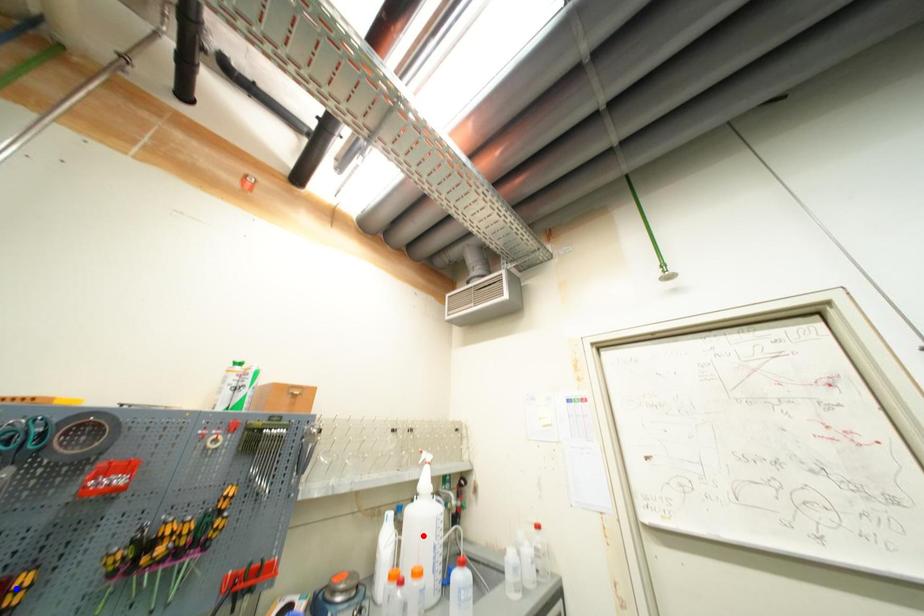
Question: Two points are marked on the image. Which point is closer to the camera?

Choices:
 (A) Blue point is closer.
 (B) Red point is closer.

Answer: (A)